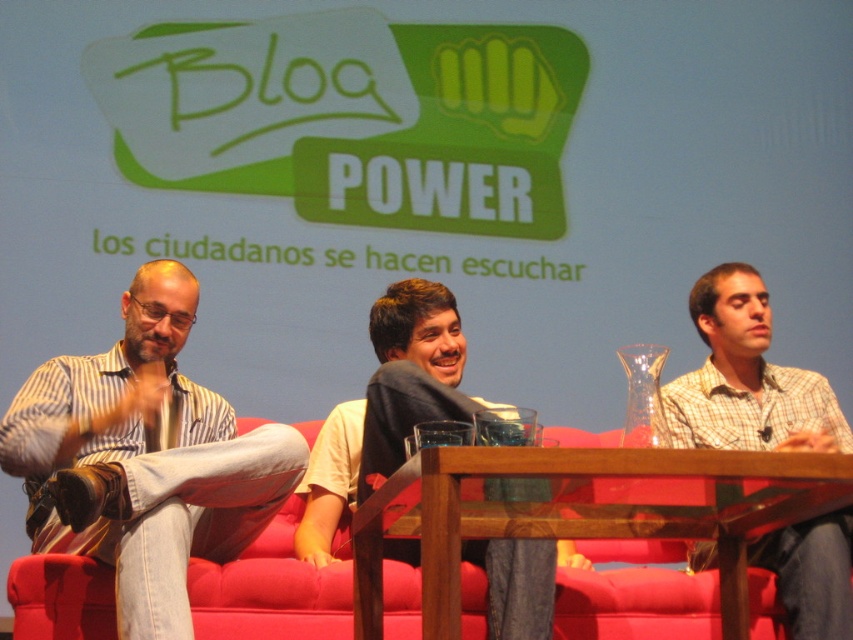
You are organizing a small event and need to place a 1.2 meter wide banner between the transparent glass table at center and the plaid shirt at center. Based on the scene description, will the banner fit between them?

The transparent glass table at center is positioned on the left side of plaid shirt at center. The distance between them is not specified, but since the banner is 1.2 meters wide, it might not fit unless there is sufficient space. However, without exact measurements, we cannot confirm.